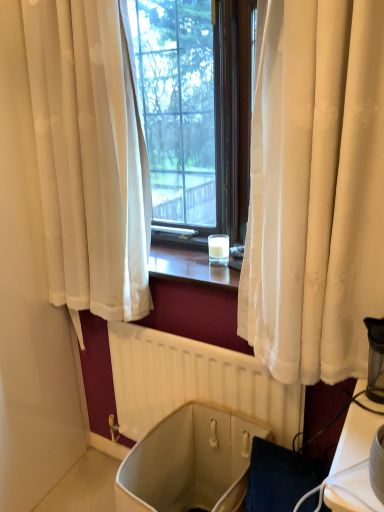
In order to face white matte radiator at center, should I rotate leftwards or rightwards?

To face it directly, rotate right by 0.327 degrees.

You are a GUI agent. You are given a task and a screenshot of the screen. Output one action in this format:
    pyautogui.click(x=<x>, y=<y>)
    Task: Click on the white matte radiator at center
    Image resolution: width=384 pixels, height=512 pixels.
    Given the screenshot: What is the action you would take?
    pyautogui.click(x=194, y=382)

The height and width of the screenshot is (512, 384). What do you see at coordinates (194, 382) in the screenshot?
I see `white matte radiator at center` at bounding box center [194, 382].

Measure the distance between white matte radiator at center and camera.

1.24 meters.

Locate an element on the screen. This screenshot has width=384, height=512. beige fabric bath at lower center is located at coordinates (189, 462).

What do you see at coordinates (189, 462) in the screenshot? Image resolution: width=384 pixels, height=512 pixels. I see `beige fabric bath at lower center` at bounding box center [189, 462].

Identify the location of white matte radiator at center. pos(194,382).

Considering the positions of objects white matte radiator at center and beige fabric bath at lower center in the image provided, who is more to the right, white matte radiator at center or beige fabric bath at lower center?

From the viewer's perspective, white matte radiator at center appears more on the right side.

Consider the image. Is white matte radiator at center positioned behind beige fabric bath at lower center?

Yes, it is.

Does point (244, 373) lie behind point (138, 460)?

Yes, point (244, 373) is behind point (138, 460).

From the image's perspective, is white matte radiator at center located above or below beige fabric bath at lower center?

white matte radiator at center is above beige fabric bath at lower center.

From a real-world perspective, between white matte radiator at center and beige fabric bath at lower center, who is vertically lower?

beige fabric bath at lower center is physically lower.

From the picture: In terms of width, does white matte radiator at center look wider or thinner when compared to beige fabric bath at lower center?

Clearly, white matte radiator at center has less width compared to beige fabric bath at lower center.

Can you confirm if white matte radiator at center is shorter than beige fabric bath at lower center?

No.

Considering the sizes of objects white matte radiator at center and beige fabric bath at lower center in the image provided, who is bigger, white matte radiator at center or beige fabric bath at lower center?

Bigger between the two is beige fabric bath at lower center.

Is white matte radiator at center inside or outside of beige fabric bath at lower center?

white matte radiator at center is spatially situated outside beige fabric bath at lower center.

Are white matte radiator at center and beige fabric bath at lower center making contact?

They are not placed beside each other.

Does white matte radiator at center turn towards beige fabric bath at lower center?

Yes, white matte radiator at center is aimed at beige fabric bath at lower center.

What's the angular difference between white matte radiator at center and beige fabric bath at lower center's facing directions?

They differ by 0.887 degrees in their facing directions.

How far apart are white matte radiator at center and beige fabric bath at lower center?

white matte radiator at center and beige fabric bath at lower center are 7.61 inches apart from each other.

The height and width of the screenshot is (512, 384). What are the coordinates of `radiator positioned vertically above the beige fabric bath at lower center (from a real-world perspective)` in the screenshot? It's located at (194, 382).

Which object is positioned more to the right, beige fabric bath at lower center or white matte radiator at center?

Positioned to the right is white matte radiator at center.

Which object is further away from the camera, beige fabric bath at lower center or white matte radiator at center?

white matte radiator at center.

Is point (179, 439) positioned before point (269, 409)?

No.

From the image's perspective, would you say beige fabric bath at lower center is shown under white matte radiator at center?

Correct, beige fabric bath at lower center appears lower than white matte radiator at center in the image.

From a real-world perspective, between beige fabric bath at lower center and white matte radiator at center, who is vertically higher?

From a 3D spatial view, white matte radiator at center is above.

Considering the relative sizes of beige fabric bath at lower center and white matte radiator at center in the image provided, is beige fabric bath at lower center wider than white matte radiator at center?

Indeed, beige fabric bath at lower center has a greater width compared to white matte radiator at center.

Looking at this image, considering the relative sizes of beige fabric bath at lower center and white matte radiator at center in the image provided, is beige fabric bath at lower center shorter than white matte radiator at center?

Yes, beige fabric bath at lower center is shorter than white matte radiator at center.

Considering the relative sizes of beige fabric bath at lower center and white matte radiator at center in the image provided, is beige fabric bath at lower center smaller than white matte radiator at center?

No, beige fabric bath at lower center is not smaller than white matte radiator at center.

Choose the correct answer: Is beige fabric bath at lower center inside white matte radiator at center or outside it?

beige fabric bath at lower center lies outside white matte radiator at center.

Based on the photo, is beige fabric bath at lower center far from white matte radiator at center?

No.

Is beige fabric bath at lower center positioned with its back to white matte radiator at center?

Yes, beige fabric bath at lower center is facing away from white matte radiator at center.

How different are the orientations of beige fabric bath at lower center and white matte radiator at center in degrees?

0.887 degrees separate the facing orientations of beige fabric bath at lower center and white matte radiator at center.

In the scene shown: How far apart are beige fabric bath at lower center and white matte radiator at center?

beige fabric bath at lower center and white matte radiator at center are 7.61 inches apart from each other.

I want to click on radiator above the beige fabric bath at lower center (from the image's perspective), so click(x=194, y=382).

In order to click on radiator above the beige fabric bath at lower center (from the image's perspective) in this screenshot , I will do coord(194,382).

Locate an element on the screen. The height and width of the screenshot is (512, 384). radiator that is above the beige fabric bath at lower center (from a real-world perspective) is located at coordinates (194, 382).